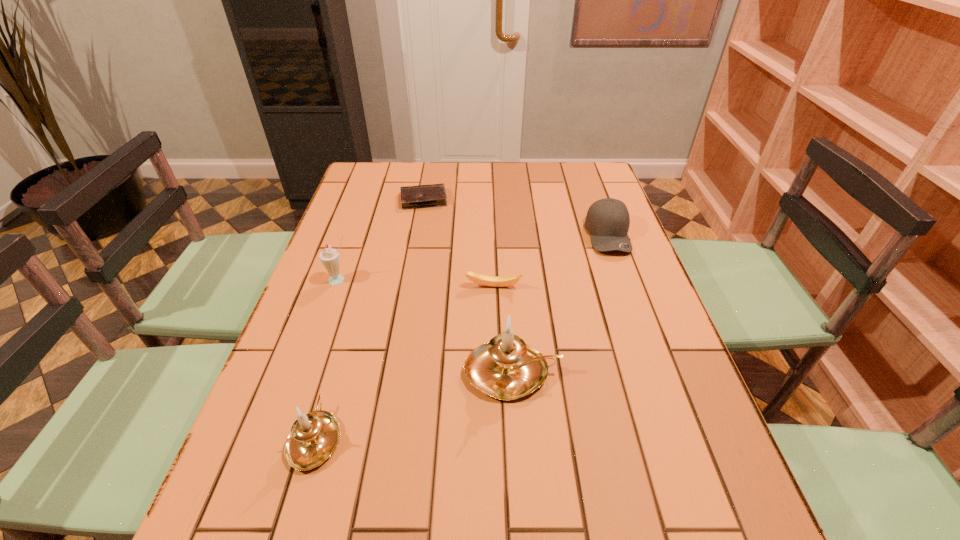
Identify the location of candle holder that is at the left edge. The width and height of the screenshot is (960, 540). (313, 438).

Image resolution: width=960 pixels, height=540 pixels. Find the location of `milkshake that is at the left edge`. milkshake that is at the left edge is located at coordinates (330, 258).

The width and height of the screenshot is (960, 540). I want to click on object that is at the right edge, so click(x=607, y=220).

This screenshot has width=960, height=540. I want to click on object present at the near left corner, so click(x=313, y=438).

This screenshot has width=960, height=540. What are the coordinates of `vacant space at the left edge of the desktop` in the screenshot? It's located at (329, 358).

Locate an element on the screen. This screenshot has width=960, height=540. vacant space at the right edge is located at coordinates (573, 208).

Where is `vacant point at the far left corner`? vacant point at the far left corner is located at coordinates (382, 186).

At what (x,y) coordinates should I click in order to perform the action: click on vacant space at the far right corner of the desktop. Please return your answer as a coordinate pair (x, y). Looking at the image, I should click on (569, 165).

Where is `vacant area that lies between the milkshake and the taller candle holder`? Image resolution: width=960 pixels, height=540 pixels. vacant area that lies between the milkshake and the taller candle holder is located at coordinates (426, 326).

The height and width of the screenshot is (540, 960). What are the coordinates of `unoccupied area between the milkshake and the shorter candle holder` in the screenshot? It's located at (327, 359).